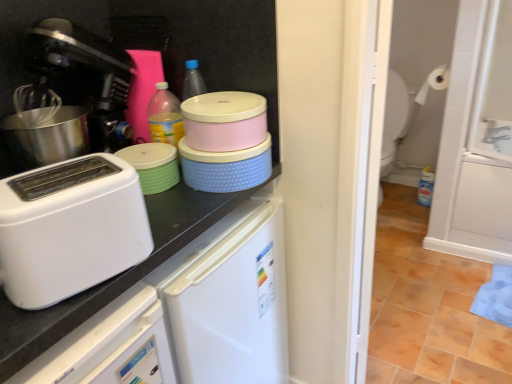
What are the coordinates of `free space in front of green matte container at center` in the screenshot? It's located at (173, 207).